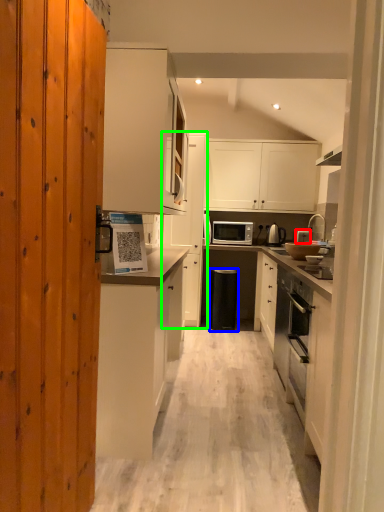
Question: Which is farther away from appliance (highlighted by a red box)? trash bin/can (highlighted by a blue box) or cabinetry (highlighted by a green box)?

Choices:
 (A) trash bin/can
 (B) cabinetry

Answer: (B)